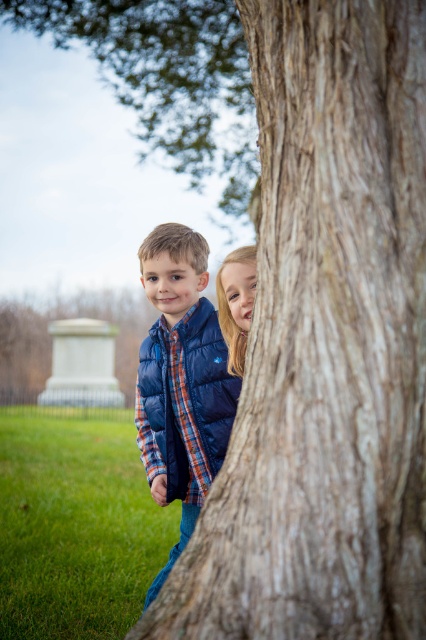
Question: Considering the real-world distances, which object is closest to the brown rough tree trunk at center?

Choices:
 (A) navy blue puffer vest at center
 (B) brown rough bark tree at upper center

Answer: (A)

Question: Can you confirm if brown rough tree trunk at center is positioned to the right of matte blue jacket at center?

Choices:
 (A) yes
 (B) no

Answer: (A)

Question: Is navy blue puffer vest at center above matte blue jacket at center?

Choices:
 (A) yes
 (B) no

Answer: (B)

Question: Based on their relative distances, which object is farther from the brown rough tree trunk at center?

Choices:
 (A) navy blue puffer vest at center
 (B) brown rough bark tree at upper center

Answer: (B)

Question: Can you confirm if brown rough tree trunk at center is positioned to the left of matte blue jacket at center?

Choices:
 (A) yes
 (B) no

Answer: (B)

Question: Which of the following is the farthest from the observer?

Choices:
 (A) (169, 230)
 (B) (241, 324)
 (C) (356, 472)
 (D) (178, 172)

Answer: (D)